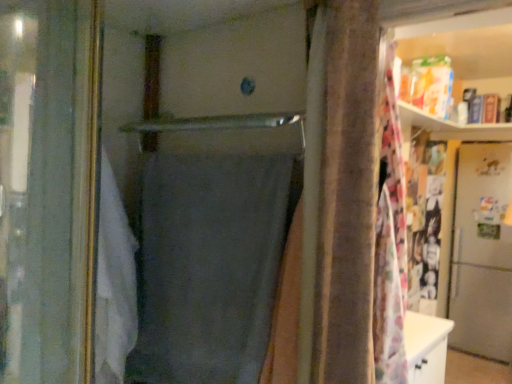
Question: Is gray matte fabric at center in contact with metallic silver refrigerator at right?

Choices:
 (A) no
 (B) yes

Answer: (A)

Question: Could you tell me if gray matte fabric at center is facing metallic silver refrigerator at right?

Choices:
 (A) yes
 (B) no

Answer: (B)

Question: Is gray matte fabric at center taller than metallic silver refrigerator at right?

Choices:
 (A) no
 (B) yes

Answer: (A)

Question: Considering the relative positions of gray matte fabric at center and metallic silver refrigerator at right in the image provided, is gray matte fabric at center to the right of metallic silver refrigerator at right from the viewer's perspective?

Choices:
 (A) no
 (B) yes

Answer: (A)

Question: Can you confirm if gray matte fabric at center is thinner than metallic silver refrigerator at right?

Choices:
 (A) yes
 (B) no

Answer: (A)

Question: Considering the relative sizes of gray matte fabric at center and metallic silver refrigerator at right in the image provided, is gray matte fabric at center shorter than metallic silver refrigerator at right?

Choices:
 (A) yes
 (B) no

Answer: (A)

Question: Can you confirm if metallic silver refrigerator at right is taller than gray matte fabric at center?

Choices:
 (A) no
 (B) yes

Answer: (B)

Question: Is metallic silver refrigerator at right to the left of gray matte fabric at center from the viewer's perspective?

Choices:
 (A) no
 (B) yes

Answer: (A)

Question: Does metallic silver refrigerator at right turn towards gray matte fabric at center?

Choices:
 (A) yes
 (B) no

Answer: (B)

Question: Is metallic silver refrigerator at right smaller than gray matte fabric at center?

Choices:
 (A) no
 (B) yes

Answer: (A)

Question: From the image's perspective, is metallic silver refrigerator at right located beneath gray matte fabric at center?

Choices:
 (A) yes
 (B) no

Answer: (A)

Question: Is gray matte fabric at center surrounded by metallic silver refrigerator at right?

Choices:
 (A) yes
 (B) no

Answer: (B)

Question: Considering the positions of metallic silver refrigerator at right and gray matte fabric at center in the image, is metallic silver refrigerator at right bigger or smaller than gray matte fabric at center?

Choices:
 (A) big
 (B) small

Answer: (A)